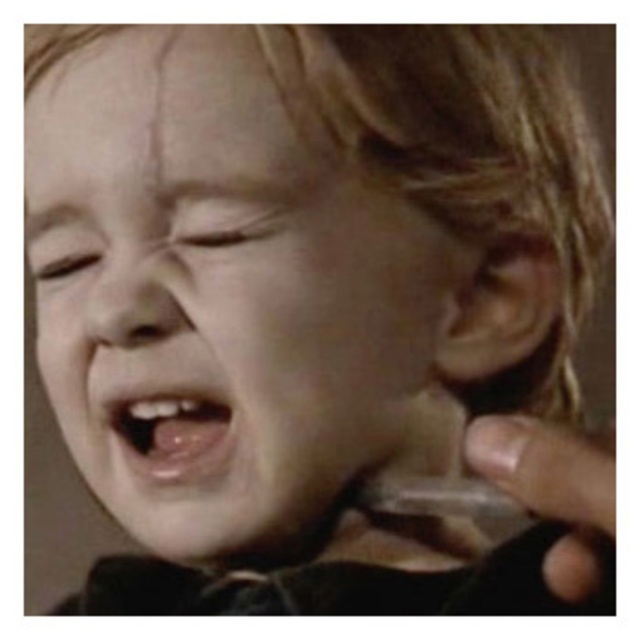
The child in the image is crying, and you need to determine which facial feature is wider between the pink glossy tongue at center and the smooth skin nose at center. Based on the scene, which one is wider?

The pink glossy tongue at center is wider than the smooth skin nose at center according to the description.

Based on the scene, which object is closer to the viewer between the pink glossy tongue at center and the smooth skin nose at center?

The pink glossy tongue at center is closer to the viewer because the smooth skin nose at center is behind it.

You are a pediatrician examining a child who is crying. You notice the smooth skin face at center and the pink glossy tongue at center. How far apart are these two features?

The smooth skin face at center and the pink glossy tongue at center are 5.70 centimeters apart from each other.